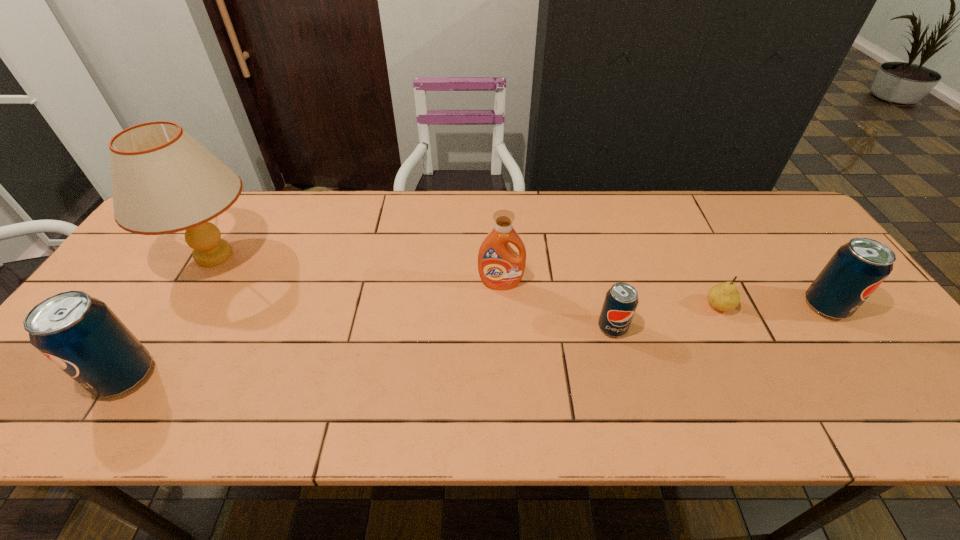
I want to click on object located at the right edge, so click(855, 271).

I want to click on object at the far left corner, so click(x=164, y=181).

Identify the location of object at the near left corner. (80, 334).

In the image, there is a desktop. At what (x,y) coordinates should I click in order to perform the action: click on vacant region at the far edge. Please return your answer as a coordinate pair (x, y). The width and height of the screenshot is (960, 540). Looking at the image, I should click on (679, 215).

Where is `free space at the near edge of the desktop`? The height and width of the screenshot is (540, 960). free space at the near edge of the desktop is located at coordinates (340, 357).

Where is `vacant space at the left edge of the desktop`? vacant space at the left edge of the desktop is located at coordinates (140, 269).

The image size is (960, 540). In the image, there is a desktop. Identify the location of vacant space at the far right corner. (779, 219).

This screenshot has width=960, height=540. I want to click on vacant area between the fifth object from left to right and the tallest object, so click(x=467, y=281).

This screenshot has height=540, width=960. I want to click on vacant space that's between the fourth object from right to left and the tallest object, so click(357, 269).

Locate an element on the screen. The height and width of the screenshot is (540, 960). vacant region between the nearest soda can and the fourth tallest object is located at coordinates (475, 341).